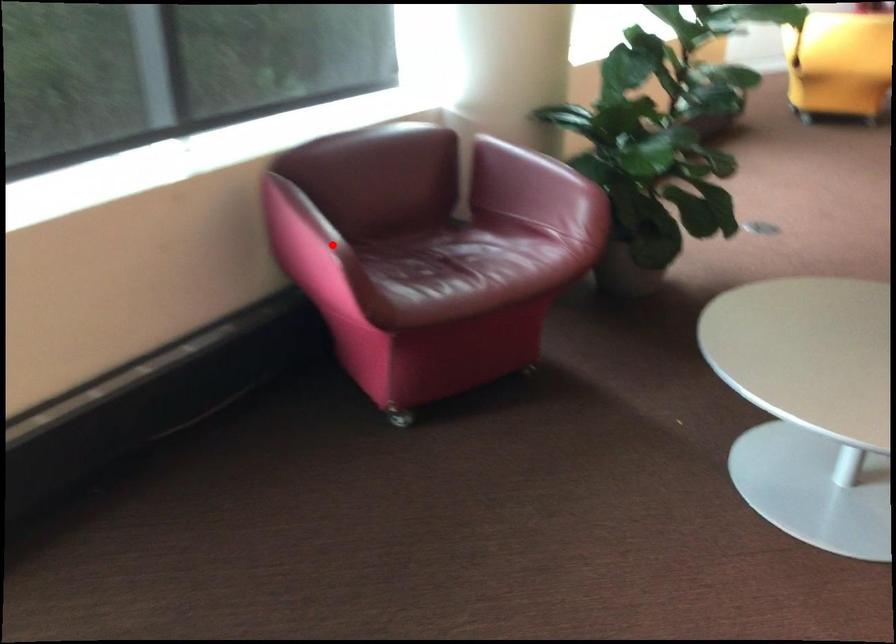
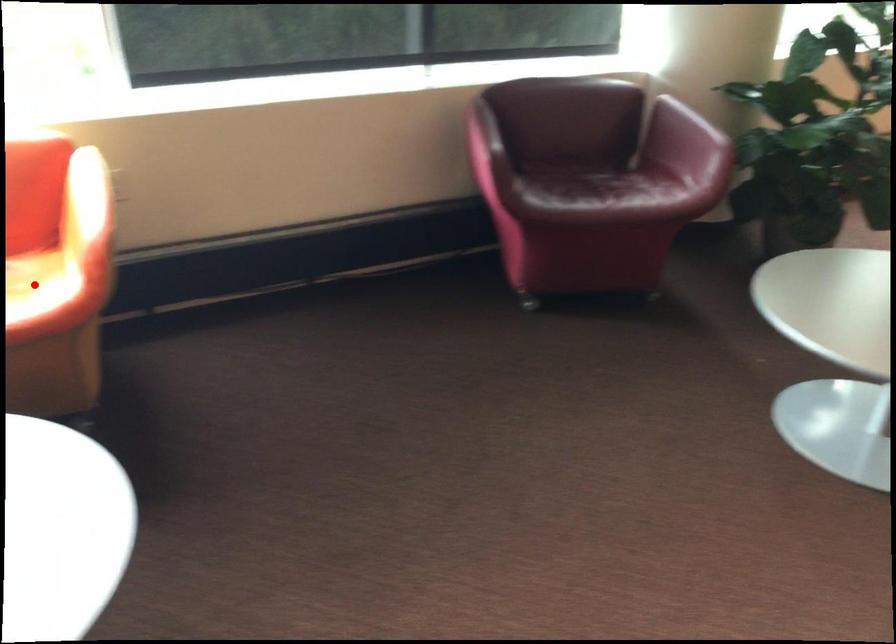
In the scene shown: I am providing you with two images of the same scene from different viewpoints. A red point is marked on the first image and another point is marked on the second image. Is the marked point in image1 the same physical position as the marked point in image2?

No